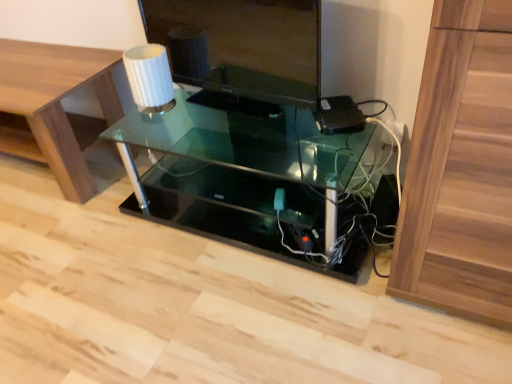
Question: Considering the positions of white ribbed glass at upper center and matte black monitor at center in the image, is white ribbed glass at upper center bigger or smaller than matte black monitor at center?

Choices:
 (A) small
 (B) big

Answer: (A)

Question: From the image's perspective, is white ribbed glass at upper center above or below matte black monitor at center?

Choices:
 (A) above
 (B) below

Answer: (B)

Question: Considering the real-world distances, which object is closest to the transparent glass table at center?

Choices:
 (A) matte black monitor at center
 (B) wooden table at lower left
 (C) white ribbed glass at upper center

Answer: (A)

Question: Considering the real-world distances, which object is closest to the transparent glass table at center?

Choices:
 (A) matte black monitor at center
 (B) white ribbed glass at upper center
 (C) wooden table at lower left

Answer: (A)